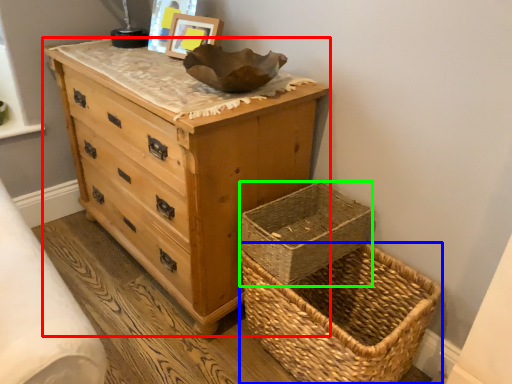
Question: Which object is positioned farthest from chest of drawers (highlighted by a red box)? Select from picnic basket (highlighted by a blue box) and basket container (highlighted by a green box).

Choices:
 (A) picnic basket
 (B) basket container

Answer: (A)